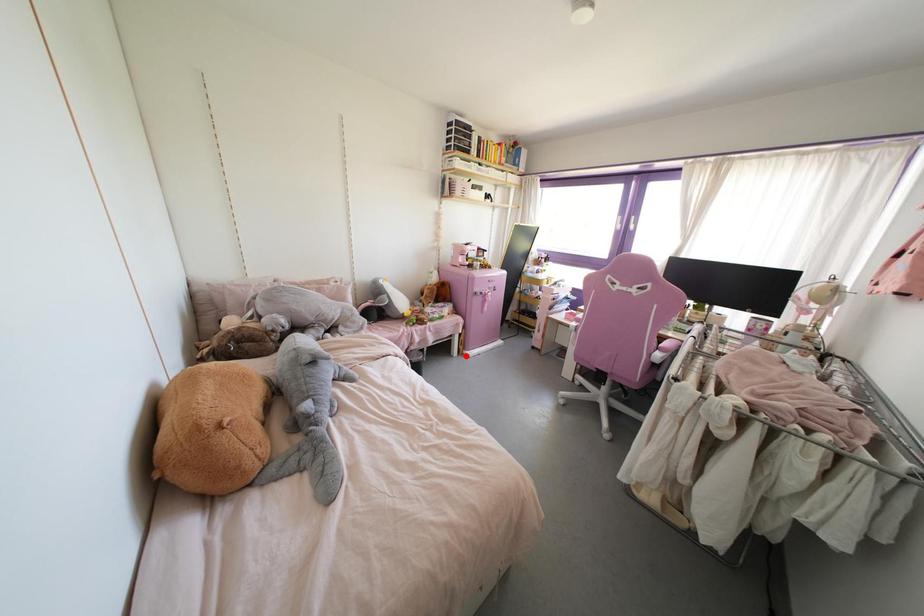
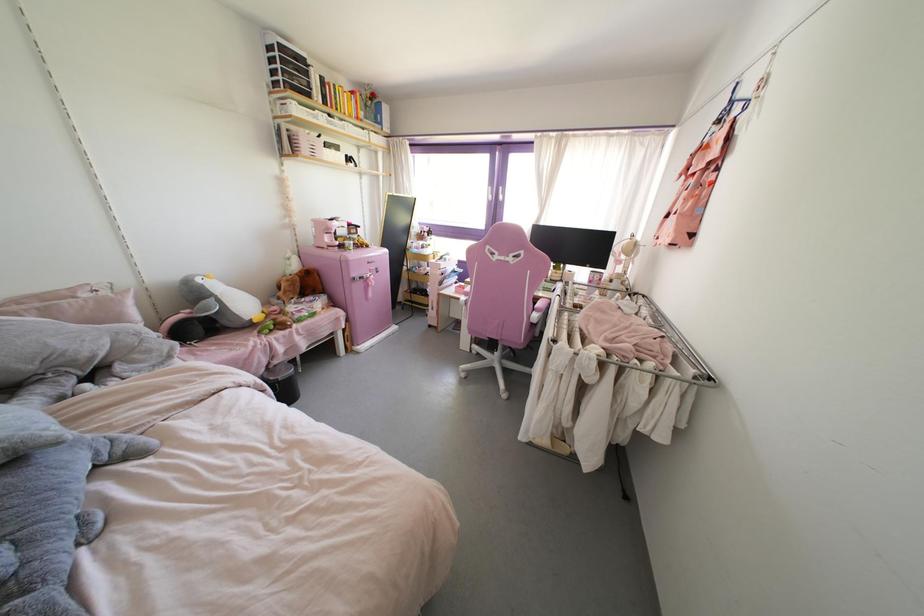
Question: A red point is marked in image1. In image2, is the corresponding 3D point closer to the camera or farther? Reply with the corresponding letter.

Choices:
 (A) The corresponding 3D point is closer.
 (B) The corresponding 3D point is farther.

Answer: (A)